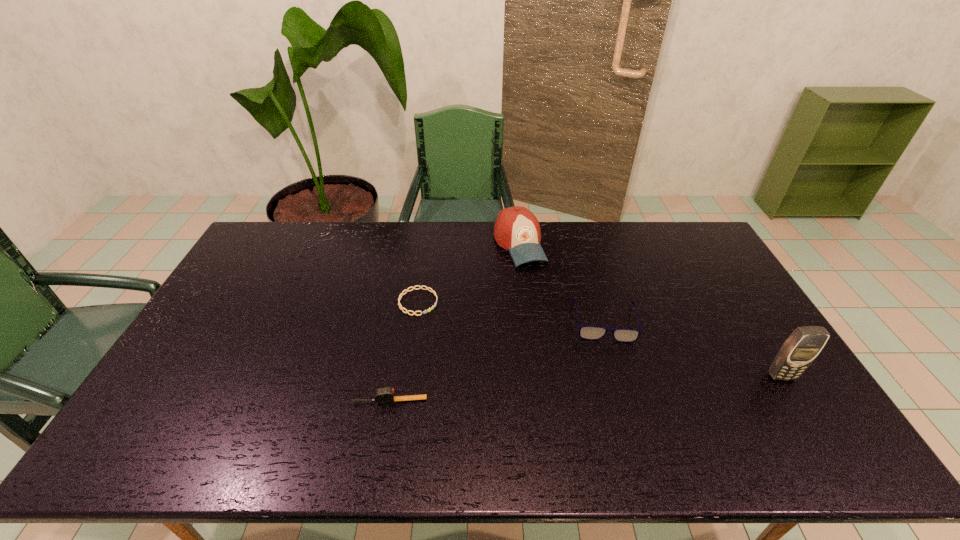
The width and height of the screenshot is (960, 540). I want to click on object that is the fourth nearest to the fourth farthest object, so click(420, 287).